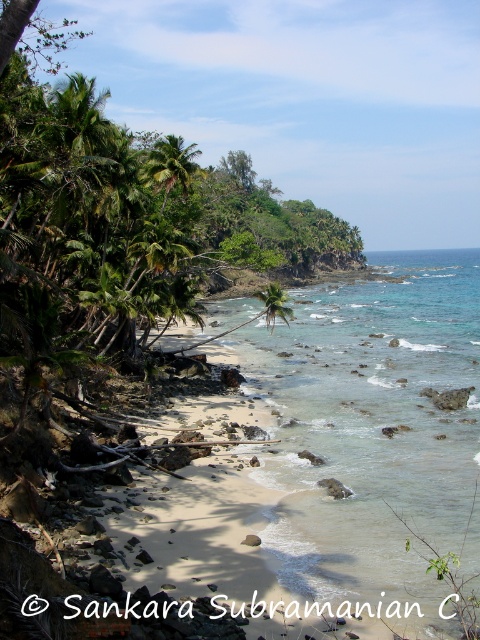
You are standing on the beach and see the point marked at coordinates (170, 164). What object is located at that point?

The point at coordinates (170, 164) indicates a green leafy palm tree at upper left.